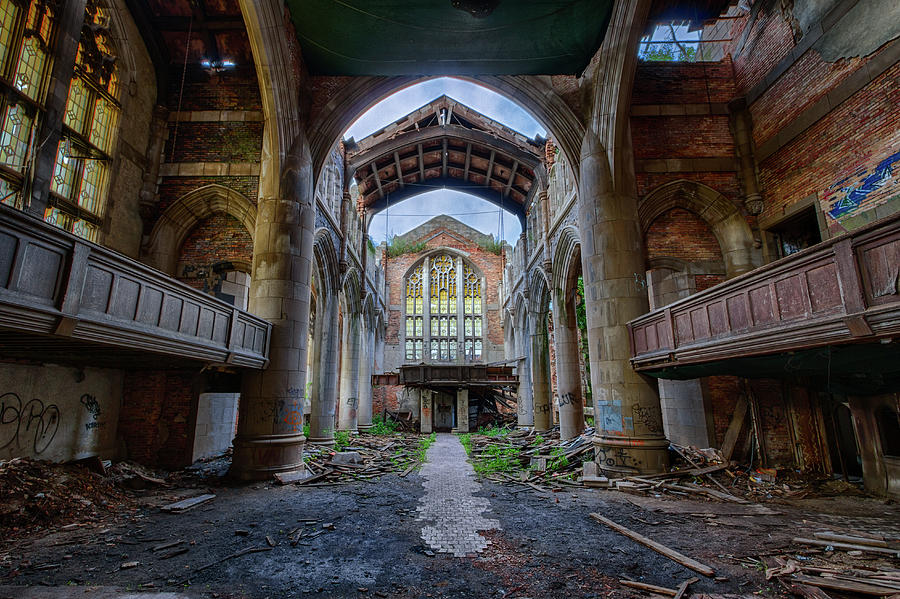
You are a GUI agent. You are given a task and a screenshot of the screen. Output one action in this format:
    pyautogui.click(x=<x>, y=<y>)
    Task: Click on the stained glass window
    
    Given the screenshot: What is the action you would take?
    pyautogui.click(x=437, y=297)